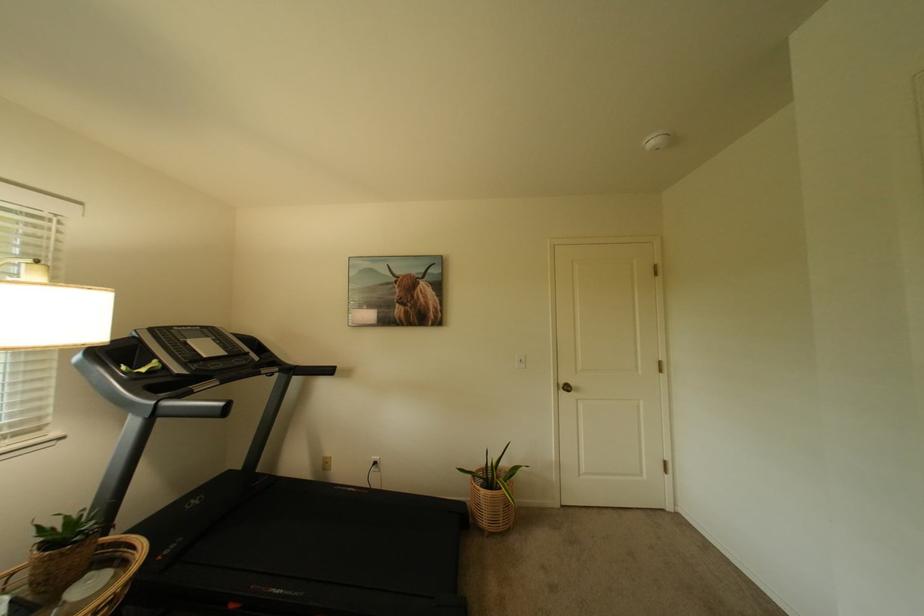
This screenshot has width=924, height=616. I want to click on brass doorknob, so [565, 387].